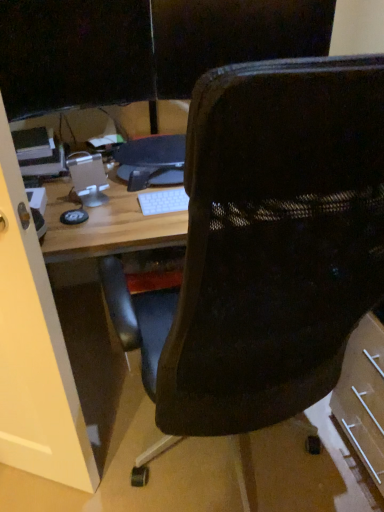
Identify the location of empty space that is to the right of transparent glass door at left. (116, 463).